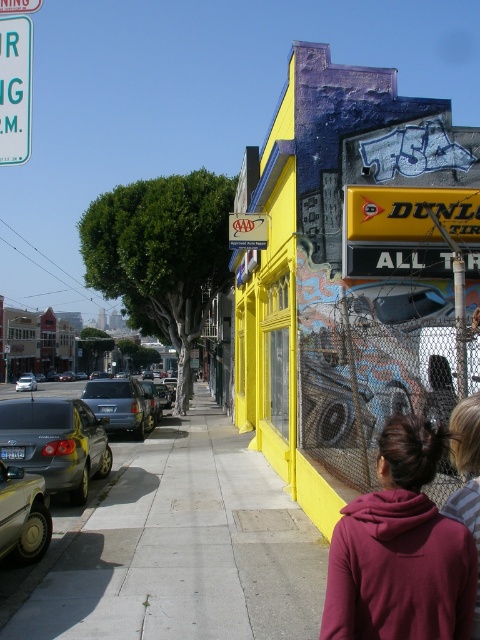
Is metallic gray sedan at left to the left of satin silver suv at center-left from the viewer's perspective?

In fact, metallic gray sedan at left is to the right of satin silver suv at center-left.

Between point (84, 404) and point (109, 404), which one is positioned behind?

Point (109, 404)

Between point (46, 413) and point (100, 400), which one is positioned behind?

The point (100, 400) is behind.

This screenshot has height=640, width=480. In order to click on metallic gray sedan at left in this screenshot , I will do `click(56, 442)`.

Does yellow plastic sign at center have a greater width compared to silver metallic sedan at left?

Incorrect, yellow plastic sign at center's width does not surpass silver metallic sedan at left's.

Consider the image. Does yellow plastic sign at center have a larger size compared to silver metallic sedan at left?

Actually, yellow plastic sign at center might be smaller than silver metallic sedan at left.

Find the location of a particular element. Image resolution: width=480 pixels, height=640 pixels. yellow plastic sign at center is located at coordinates (248, 230).

Is metallic silver sedan at left smaller than satin silver suv at center-left?

Incorrect, metallic silver sedan at left is not smaller in size than satin silver suv at center-left.

Between metallic silver sedan at left and satin silver suv at center-left, which one has more height?

metallic silver sedan at left

Between point (1, 449) and point (133, 426), which one is positioned in front?

Point (1, 449) is in front.

At what (x,y) coordinates should I click in order to perform the action: click on metallic silver sedan at left. Please return your answer as a coordinate pair (x, y). Looking at the image, I should click on (56, 438).